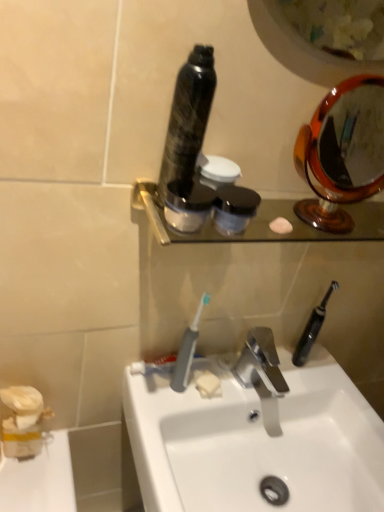
Locate an element on the screen. Image resolution: width=384 pixels, height=512 pixels. vacant position to the left of polished chrome faucet at center is located at coordinates (199, 389).